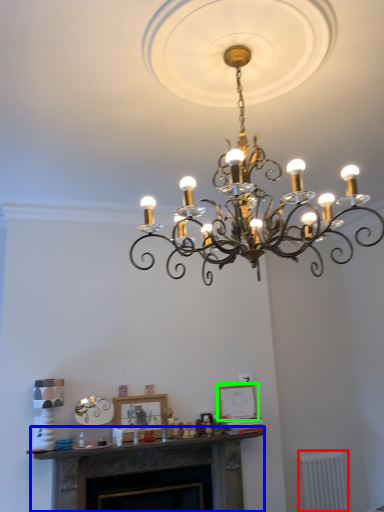
Question: Which object is positioned farthest from radiator (highlighted by a red box)? Select from fireplace (highlighted by a blue box) and picture frame (highlighted by a green box).

Choices:
 (A) fireplace
 (B) picture frame

Answer: (A)